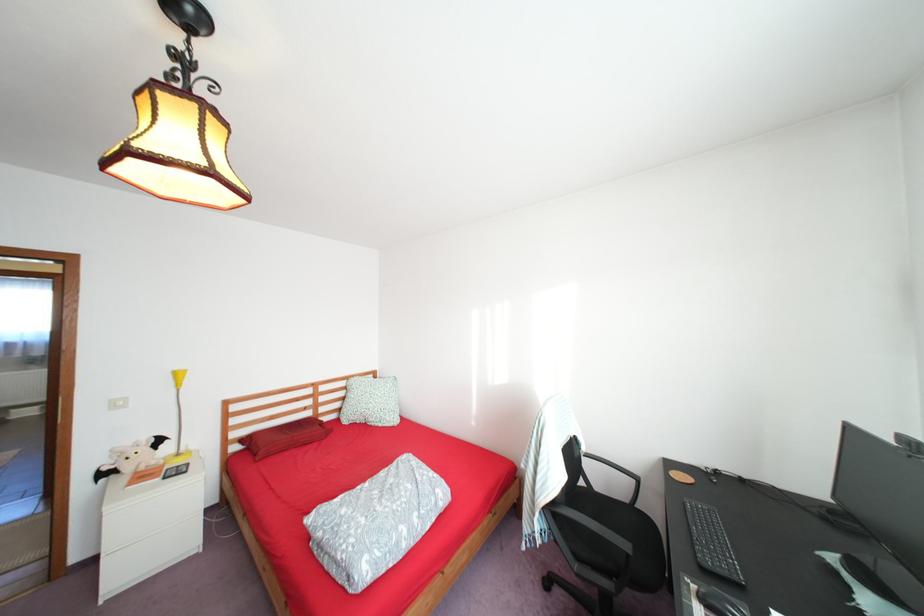
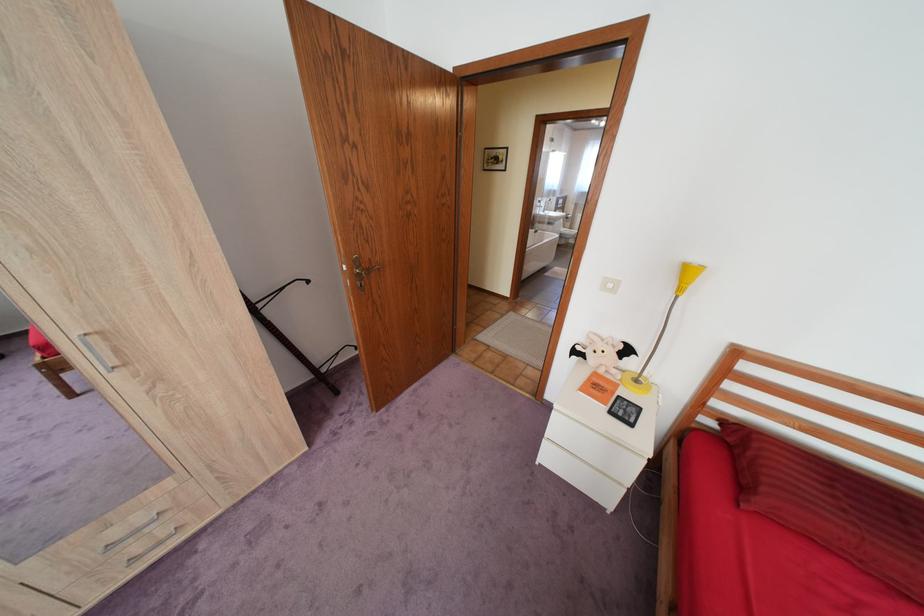
In the second image, find the point that corresponds to point 188,471 in the first image.

(636, 411)